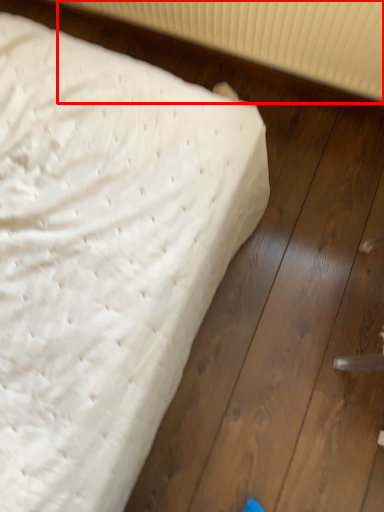
Question: From the image's perspective, what is the correct spatial relationship of radiator (annotated by the red box) in relation to bed?

Choices:
 (A) above
 (B) below

Answer: (A)